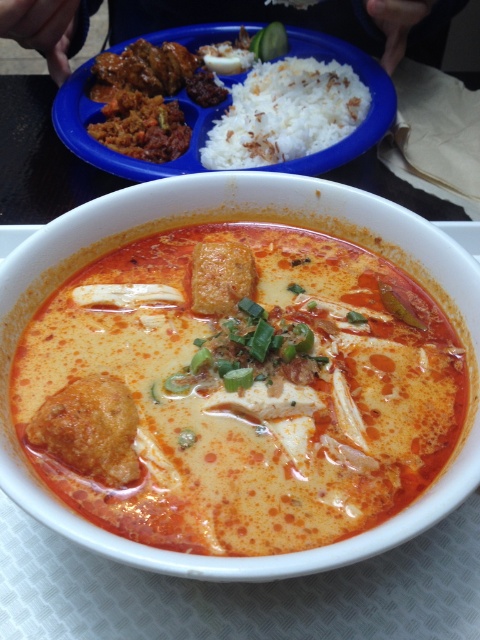
The image size is (480, 640). In order to click on creamy orange soup at center in this screenshot , I will do `click(249, 394)`.

Does point (220, 536) lie behind point (231, 140)?

No, it is in front of (231, 140).

Is point (162, 456) behind point (303, 106)?

That is False.

Where is `creamy orange soup at center`? This screenshot has height=640, width=480. creamy orange soup at center is located at coordinates (249, 394).

Is creamy orange soup at center thinner than brown crumbly meatball at center?

No, creamy orange soup at center is not thinner than brown crumbly meatball at center.

How much distance is there between creamy orange soup at center and brown crumbly meatball at center?

creamy orange soup at center and brown crumbly meatball at center are 6.49 inches apart from each other.

Identify the location of creamy orange soup at center. The height and width of the screenshot is (640, 480). click(x=249, y=394).

Can you confirm if white polished rice at upper center is positioned to the left of brown crumbly meatball at center?

In fact, white polished rice at upper center is to the right of brown crumbly meatball at center.

Does point (238, 140) lie behind point (95, 451)?

Yes, it is.

I want to click on white polished rice at upper center, so click(x=286, y=113).